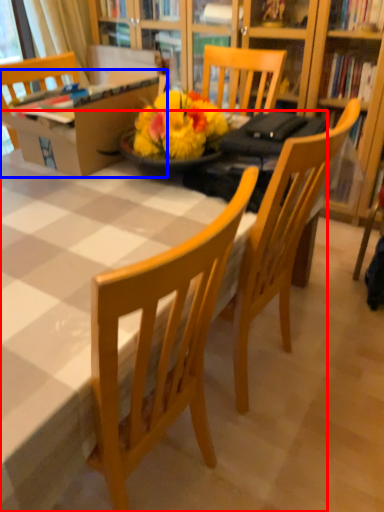
Question: Among these objects, which one is farthest to the camera, desk (highlighted by a red box) or box (highlighted by a blue box)?

Choices:
 (A) desk
 (B) box

Answer: (B)